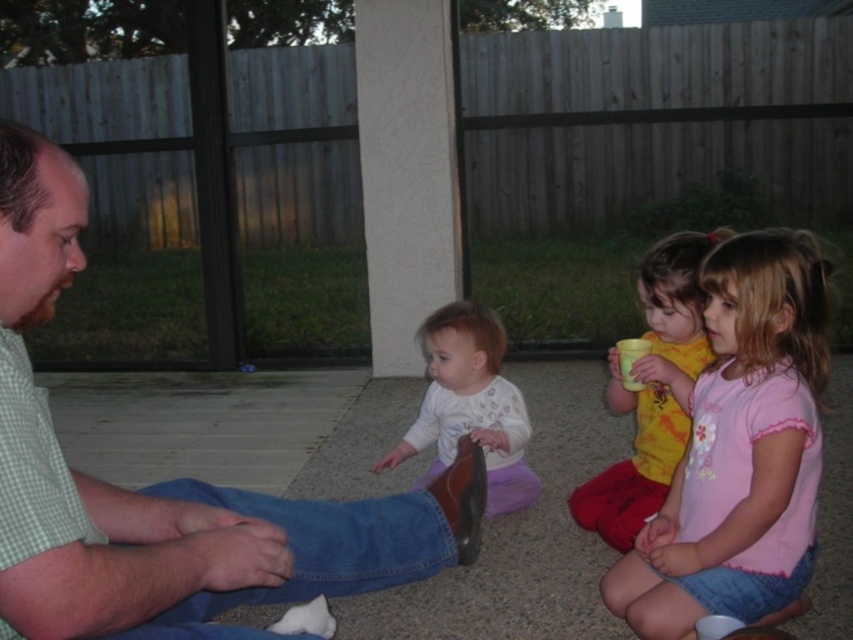
Who is shorter, pink cotton shirt at right or white soft shirt at center?

With less height is white soft shirt at center.

Is point (630, 570) closer to camera compared to point (437, 310)?

That is True.

Describe the element at coordinates (740, 451) in the screenshot. The image size is (853, 640). I see `pink cotton shirt at right` at that location.

This screenshot has width=853, height=640. In order to click on pink cotton shirt at right in this screenshot , I will do `click(740, 451)`.

Which is more to the right, matte yellow cup at center right or white soft shirt at center?

matte yellow cup at center right

Is point (672, 262) closer to viewer compared to point (491, 468)?

Yes, point (672, 262) is in front of point (491, 468).

Which is in front, point (695, 376) or point (503, 348)?

Point (695, 376)

This screenshot has height=640, width=853. In order to click on matte yellow cup at center right in this screenshot , I will do `click(653, 390)`.

Find the location of a particular element. Image resolution: width=853 pixels, height=640 pixels. green checkered shirt at left is located at coordinates (165, 483).

Between green checkered shirt at left and matte yellow cup at center right, which one appears on the left side from the viewer's perspective?

green checkered shirt at left

Find the location of `green checkered shirt at left`. green checkered shirt at left is located at coordinates (x=165, y=483).